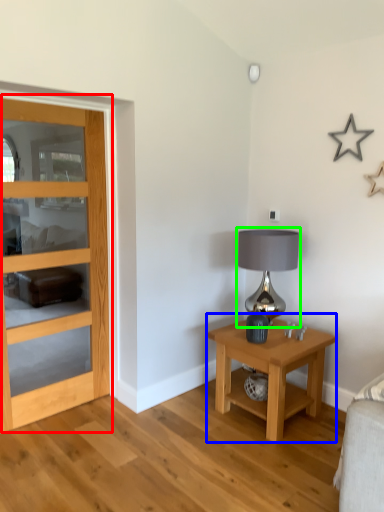
Question: Estimate the real-world distances between objects in this image. Which object is farther from door (highlighted by a red box), nightstand (highlighted by a blue box) or table lamp (highlighted by a green box)?

Choices:
 (A) nightstand
 (B) table lamp

Answer: (B)